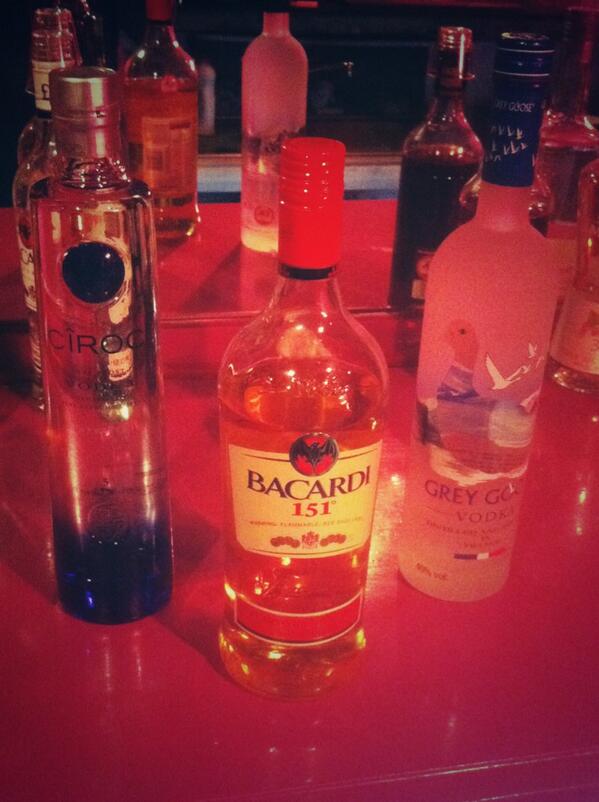
Where is `vodka bottle`? This screenshot has height=802, width=599. vodka bottle is located at coordinates (167, 107).